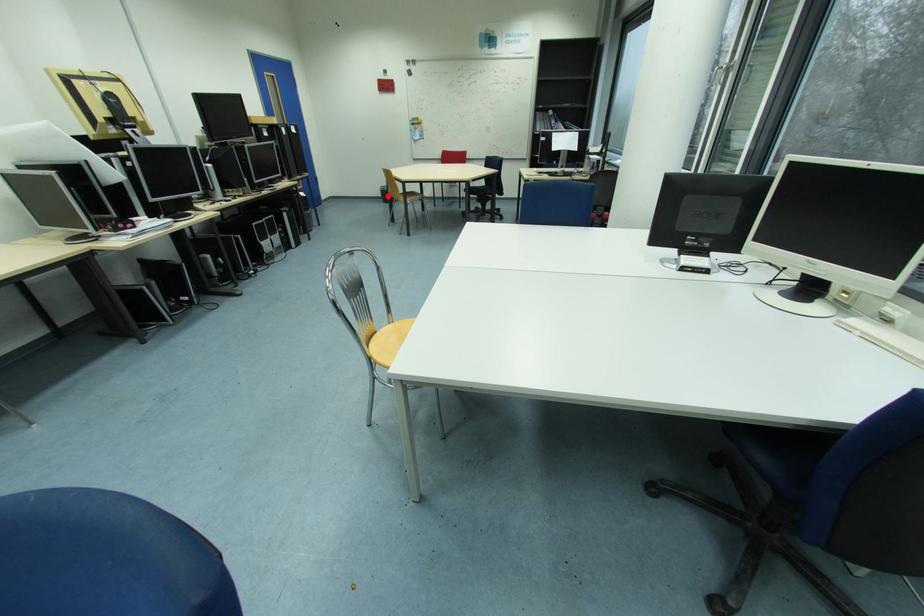
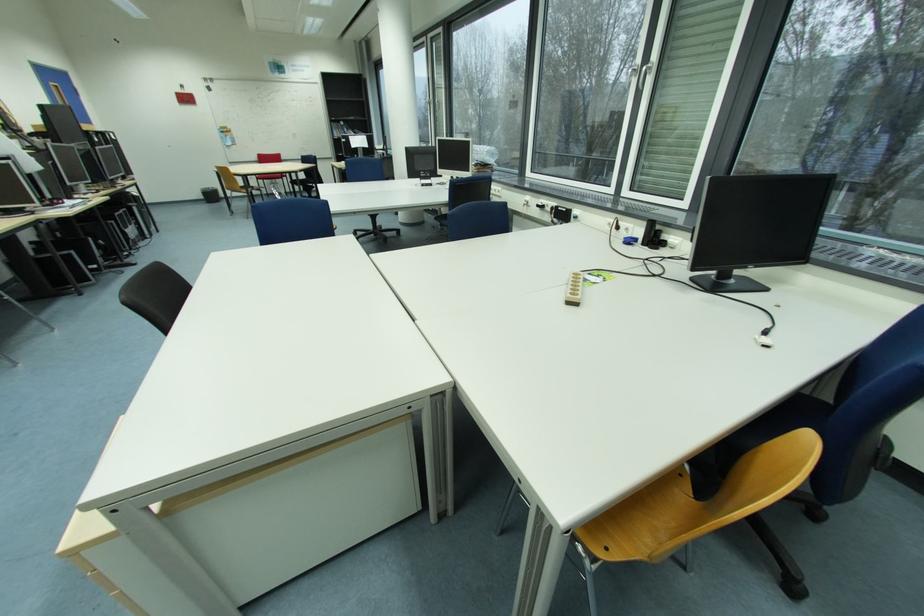
Question: I am providing you with two images of the same scene from different viewpoints. Given a red point in image1, look at the same physical point in image2. Is it:

Choices:
 (A) Closer to the viewpoint
 (B) Farther from the viewpoint

Answer: (A)